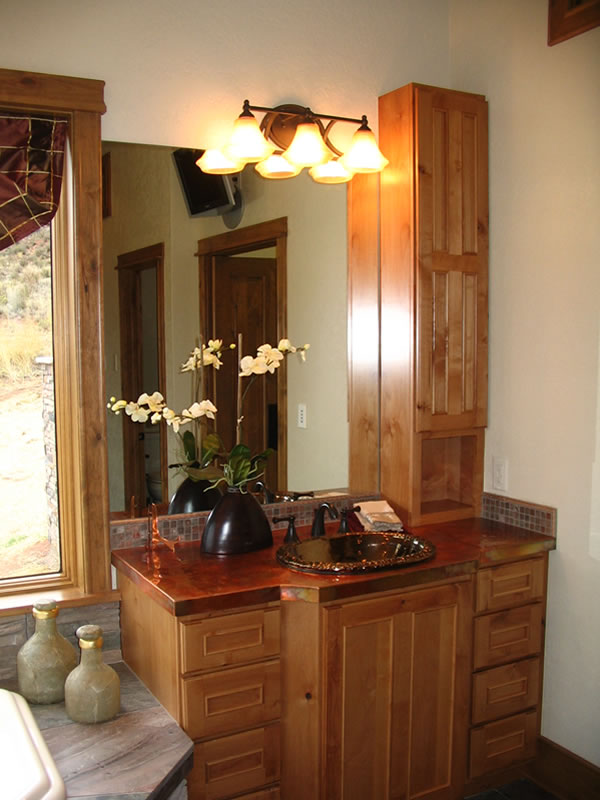
This screenshot has width=600, height=800. Identify the location of napkins. (381, 518).